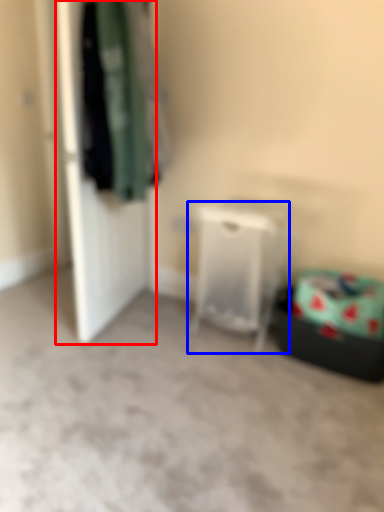
Question: Which point is further to the camera, door (highlighted by a red box) or furniture (highlighted by a blue box)?

Choices:
 (A) door
 (B) furniture

Answer: (B)